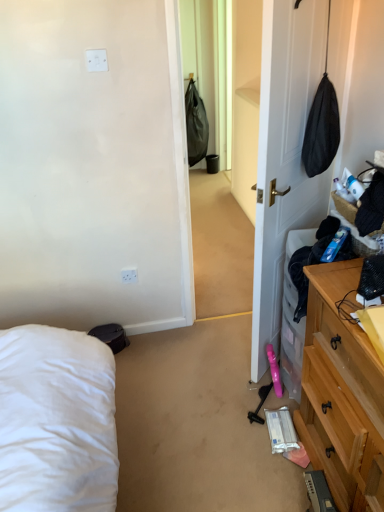
Question: Is the surface of white plastic electric outlet at upper center in direct contact with white matte door at center?

Choices:
 (A) no
 (B) yes

Answer: (A)

Question: Considering the relative sizes of white plastic electric outlet at upper center and white matte door at center in the image provided, is white plastic electric outlet at upper center smaller than white matte door at center?

Choices:
 (A) no
 (B) yes

Answer: (B)

Question: Is white plastic electric outlet at upper center taller than white matte door at center?

Choices:
 (A) no
 (B) yes

Answer: (A)

Question: Is white plastic electric outlet at upper center wider than white matte door at center?

Choices:
 (A) no
 (B) yes

Answer: (A)

Question: Is white plastic electric outlet at upper center aimed at white matte door at center?

Choices:
 (A) yes
 (B) no

Answer: (B)

Question: Considering the relative positions of white plastic electric outlet at upper center and white matte door at center in the image provided, is white plastic electric outlet at upper center to the left of white matte door at center from the viewer's perspective?

Choices:
 (A) no
 (B) yes

Answer: (B)

Question: Is light wood dresser at right not within white matte door at center?

Choices:
 (A) no
 (B) yes

Answer: (B)

Question: Can you confirm if light wood dresser at right is wider than white matte door at center?

Choices:
 (A) no
 (B) yes

Answer: (B)

Question: Does light wood dresser at right have a greater height compared to white matte door at center?

Choices:
 (A) no
 (B) yes

Answer: (A)

Question: From the image's perspective, is light wood dresser at right under white matte door at center?

Choices:
 (A) no
 (B) yes

Answer: (B)

Question: Can you confirm if light wood dresser at right is smaller than white matte door at center?

Choices:
 (A) no
 (B) yes

Answer: (A)

Question: Is light wood dresser at right at the right side of white matte door at center?

Choices:
 (A) no
 (B) yes

Answer: (B)

Question: Is light wood dresser at right at the right side of white plastic electric outlet at upper center?

Choices:
 (A) no
 (B) yes

Answer: (B)